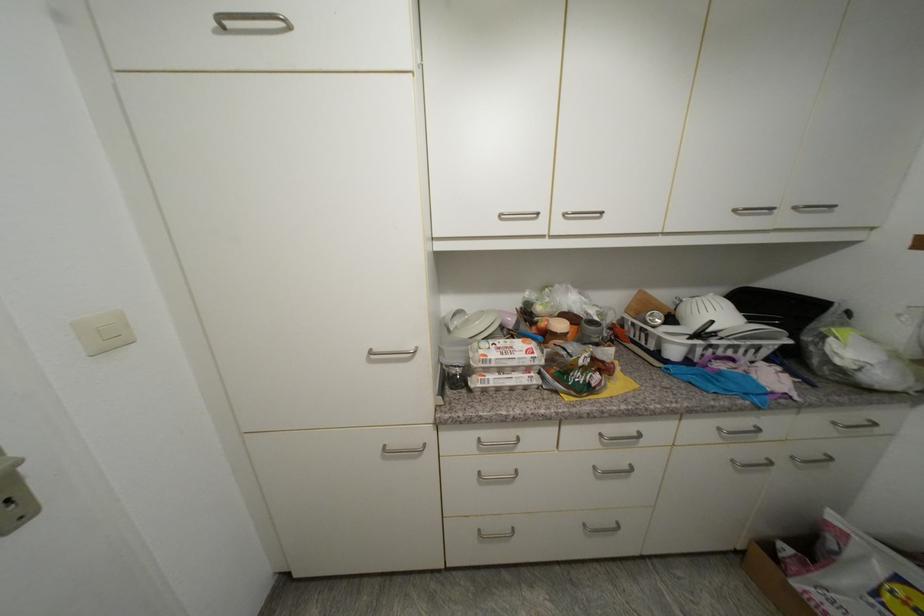
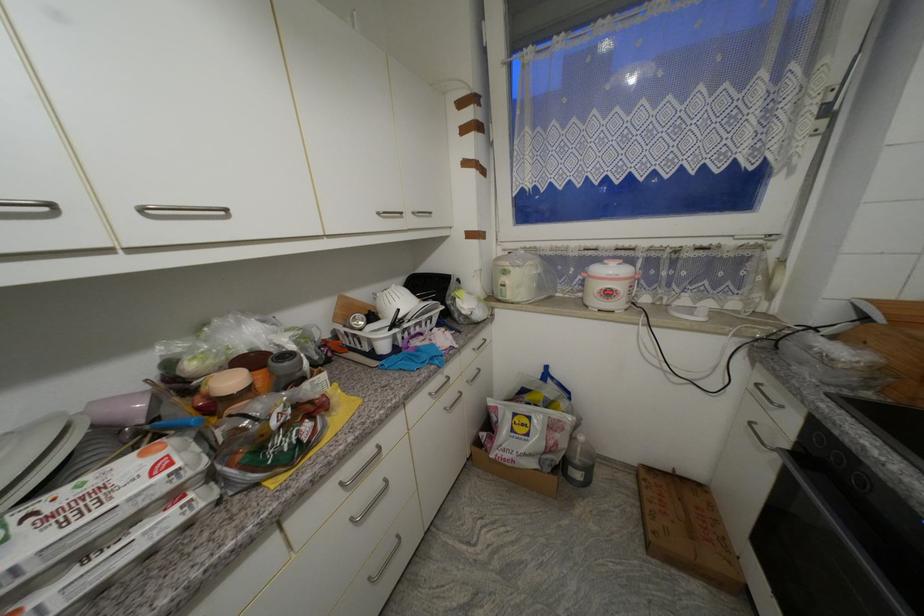
Where in the second image is the point corresponding to [740,213] from the first image?

(383, 215)